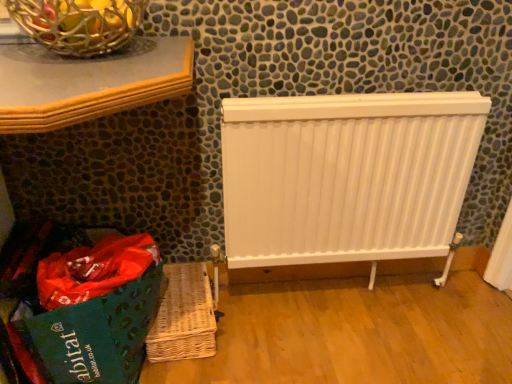
Question: Does white matte radiator at center have a greater height compared to woven brown basket at lower left?

Choices:
 (A) no
 (B) yes

Answer: (B)

Question: Is white matte radiator at center next to woven brown basket at lower left and touching it?

Choices:
 (A) no
 (B) yes

Answer: (A)

Question: Is white matte radiator at center to the left of woven brown basket at lower left from the viewer's perspective?

Choices:
 (A) yes
 (B) no

Answer: (B)

Question: Can you confirm if white matte radiator at center is wider than woven brown basket at lower left?

Choices:
 (A) yes
 (B) no

Answer: (B)

Question: Does white matte radiator at center come behind woven brown basket at lower left?

Choices:
 (A) no
 (B) yes

Answer: (A)

Question: Considering the relative sizes of white matte radiator at center and woven brown basket at lower left in the image provided, is white matte radiator at center thinner than woven brown basket at lower left?

Choices:
 (A) no
 (B) yes

Answer: (B)

Question: Does green fabric shopping bag at lower left have a greater width compared to metallic wire basket at upper left?

Choices:
 (A) no
 (B) yes

Answer: (B)

Question: From the image's perspective, would you say green fabric shopping bag at lower left is positioned over metallic wire basket at upper left?

Choices:
 (A) yes
 (B) no

Answer: (B)

Question: Is green fabric shopping bag at lower left outside of metallic wire basket at upper left?

Choices:
 (A) yes
 (B) no

Answer: (A)

Question: From the image's perspective, is green fabric shopping bag at lower left located beneath metallic wire basket at upper left?

Choices:
 (A) yes
 (B) no

Answer: (A)

Question: Is the position of green fabric shopping bag at lower left less distant than that of metallic wire basket at upper left?

Choices:
 (A) no
 (B) yes

Answer: (A)

Question: Are green fabric shopping bag at lower left and metallic wire basket at upper left far apart?

Choices:
 (A) yes
 (B) no

Answer: (B)

Question: Considering the relative sizes of woven brown basket at lower left and white matte radiator at center in the image provided, is woven brown basket at lower left shorter than white matte radiator at center?

Choices:
 (A) yes
 (B) no

Answer: (A)